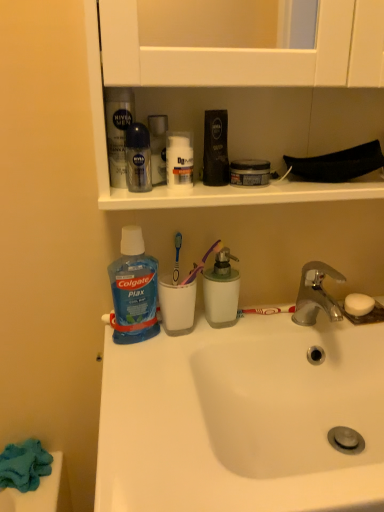
Question: Could translucent plastic mouthwash at center, arranged as the third mouthwash when viewed from the left, be considered to be inside matte black shaving cream at upper center, placed as the first toiletry when sorted from right to left?

Choices:
 (A) no
 (B) yes

Answer: (A)

Question: Is matte black shaving cream at upper center, placed as the first toiletry when sorted from right to left, bigger than translucent plastic mouthwash at center, arranged as the third mouthwash when viewed from the left?

Choices:
 (A) no
 (B) yes

Answer: (A)

Question: Considering the relative sizes of matte black shaving cream at upper center, acting as the 2th toiletry starting from the left, and translucent plastic mouthwash at center, arranged as the third mouthwash when viewed from the left, in the image provided, is matte black shaving cream at upper center, acting as the 2th toiletry starting from the left, thinner than translucent plastic mouthwash at center, arranged as the third mouthwash when viewed from the left,?

Choices:
 (A) no
 (B) yes

Answer: (B)

Question: Can you confirm if matte black shaving cream at upper center, placed as the first toiletry when sorted from right to left, is smaller than translucent plastic mouthwash at center, arranged as the third mouthwash when viewed from the left?

Choices:
 (A) no
 (B) yes

Answer: (B)

Question: Is matte black shaving cream at upper center, acting as the 2th toiletry starting from the left, far away from translucent plastic mouthwash at center, arranged as the third mouthwash when viewed from the left?

Choices:
 (A) no
 (B) yes

Answer: (A)

Question: In the image, is blue translucent liquid at lower left positioned in front of or behind white matte jar at upper center, acting as the first toiletry starting from the left?

Choices:
 (A) front
 (B) behind

Answer: (B)

Question: Is blue translucent liquid at lower left wider or thinner than white matte jar at upper center, the 2th toiletry when ordered from right to left?

Choices:
 (A) thin
 (B) wide

Answer: (B)

Question: In terms of size, does blue translucent liquid at lower left appear bigger or smaller than white matte jar at upper center, acting as the first toiletry starting from the left?

Choices:
 (A) big
 (B) small

Answer: (A)

Question: Would you say blue translucent liquid at lower left is to the left or to the right of white matte jar at upper center, acting as the first toiletry starting from the left, in the picture?

Choices:
 (A) right
 (B) left

Answer: (B)

Question: Based on their sizes in the image, would you say white matte jar at upper center, acting as the first toiletry starting from the left, is bigger or smaller than blue translucent liquid at lower left?

Choices:
 (A) small
 (B) big

Answer: (A)

Question: Considering the relative positions of white matte jar at upper center, the 2th toiletry when ordered from right to left, and blue translucent liquid at lower left in the image provided, is white matte jar at upper center, the 2th toiletry when ordered from right to left, to the left or to the right of blue translucent liquid at lower left?

Choices:
 (A) right
 (B) left

Answer: (A)

Question: From the image's perspective, is white matte jar at upper center, the 2th toiletry when ordered from right to left, located above or below blue translucent liquid at lower left?

Choices:
 (A) below
 (B) above

Answer: (B)

Question: In terms of height, does white matte jar at upper center, acting as the first toiletry starting from the left, look taller or shorter compared to blue translucent liquid at lower left?

Choices:
 (A) short
 (B) tall

Answer: (A)

Question: In terms of size, does blue plastic toothbrush at center, which is the 1th toothbrush from left to right, appear bigger or smaller than white matte jar at upper center, acting as the first toiletry starting from the left?

Choices:
 (A) big
 (B) small

Answer: (B)

Question: From a real-world perspective, relative to white matte jar at upper center, the 2th toiletry when ordered from right to left, is blue plastic toothbrush at center, which is the 1th toothbrush from left to right, vertically above or below?

Choices:
 (A) below
 (B) above

Answer: (A)